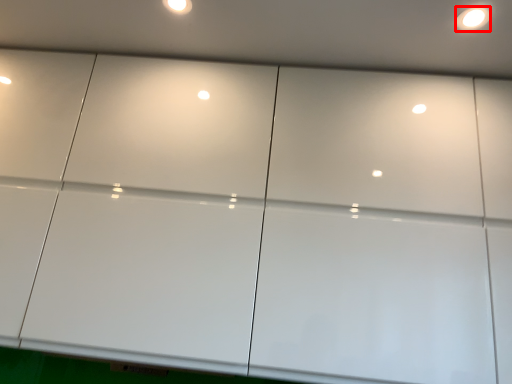
Question: In this image, where is light (annotated by the red box) located relative to dot?

Choices:
 (A) left
 (B) right

Answer: (B)